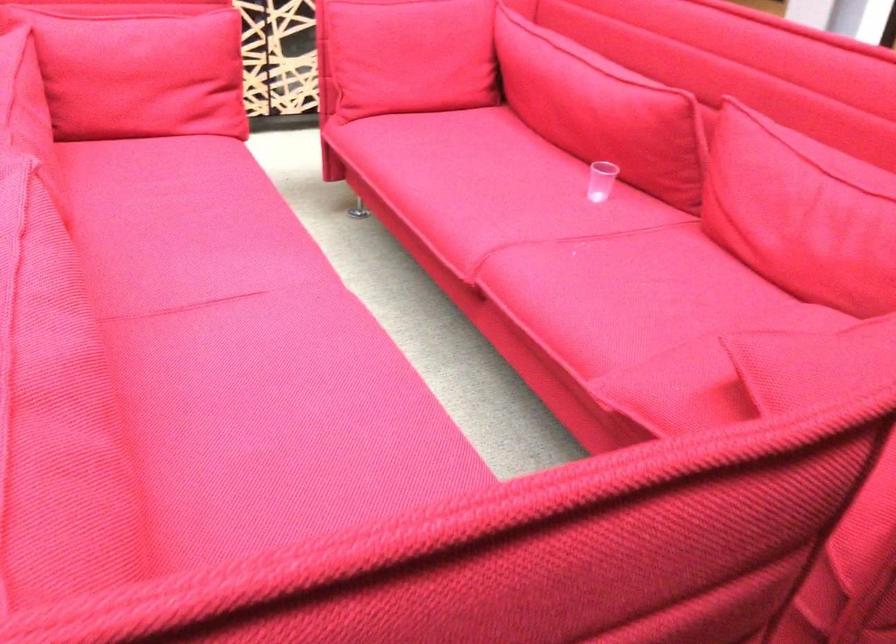
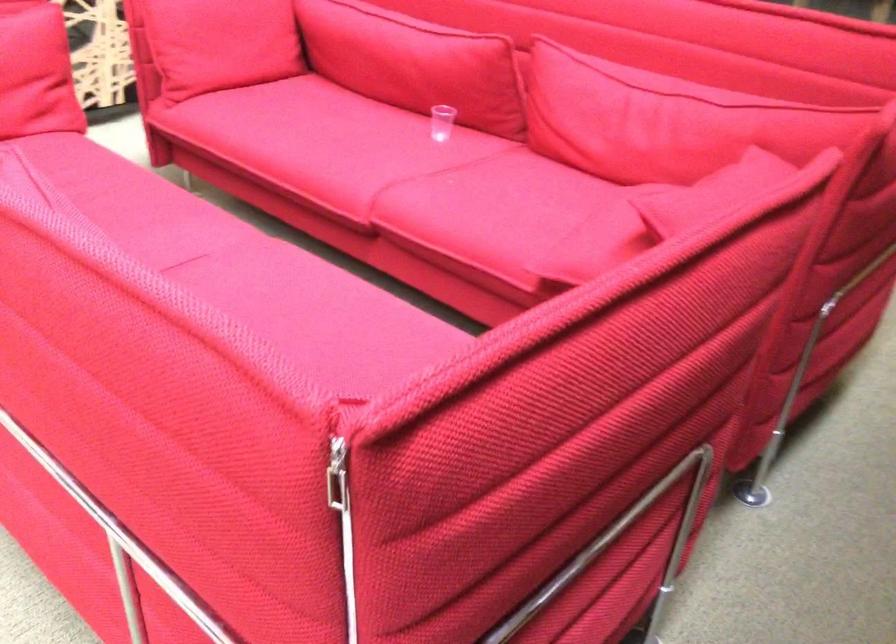
In the second image, find the point that corresponds to the point at 610,181 in the first image.

(442, 122)